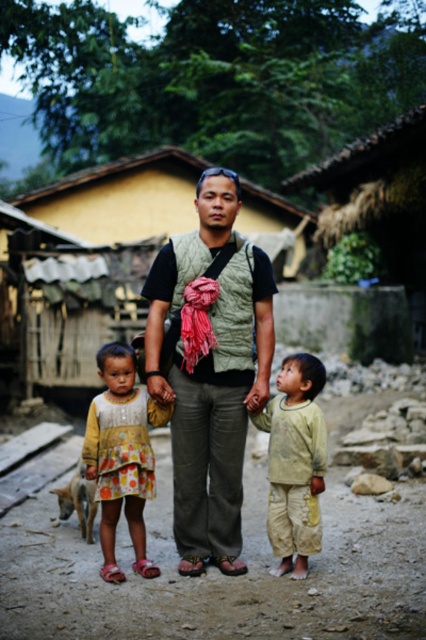
You are standing at the origin of the coordinate system in the image. You want to walk towards the point with coordinates (212, 374). What object will you be approaching?

The point at coordinates (212, 374) corresponds to the green textured vest at center, so you will be approaching the green textured vest at center.

Looking at this image, you are an observer looking at the scene. You notice the green textured vest at center and the light green fabric pants at center. Which clothing item is covering the other?

The green textured vest at center is positioned over the light green fabric pants at center, so the vest is covering the pants.

You are a photographer trying to capture a group photo of the polka dot dress at center and the light green fabric pants at center. Since you want to ensure both subjects are in focus, you need to know which one is taller. Can you tell me which is taller?

The polka dot dress at center is taller than the light green fabric pants at center according to the description.